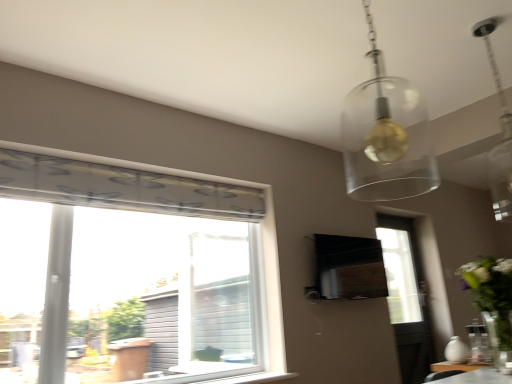
Question: From the image's perspective, relative to translucent glass globe at upper center, is white plastic window sill at lower center above or below?

Choices:
 (A) above
 (B) below

Answer: (B)

Question: Is white plastic window sill at lower center spatially inside translucent glass globe at upper center, or outside of it?

Choices:
 (A) outside
 (B) inside

Answer: (A)

Question: Which is farther from the white glossy vase at right?

Choices:
 (A) translucent glass globe at upper center
 (B) black matte vent at center
 (C) clear glass pendant light at upper right
 (D) white plastic window sill at lower center
 (E) white matte vase at lower right

Answer: (C)

Question: Which object is positioned closest to the white plastic window sill at lower center?

Choices:
 (A) clear glass pendant light at upper right
 (B) translucent glass globe at upper center
 (C) white glossy vase at right
 (D) white matte vase at lower right
 (E) black matte vent at center

Answer: (E)